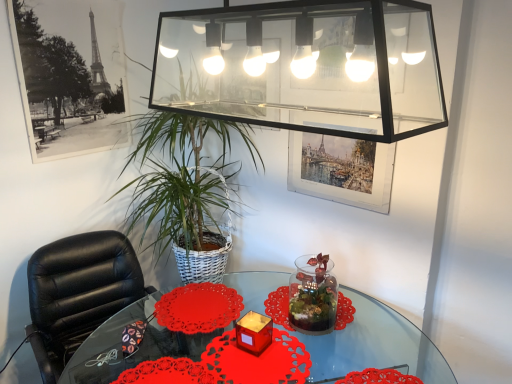
The height and width of the screenshot is (384, 512). I want to click on unoccupied space behind translucent glass candle at center, so click(242, 316).